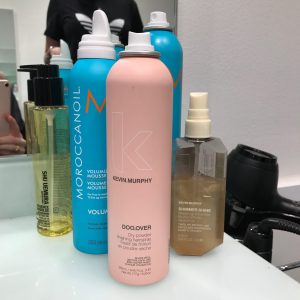
Where is `bottle`? The image size is (300, 300). bottle is located at coordinates (139, 183), (196, 197), (88, 163), (57, 157), (169, 52).